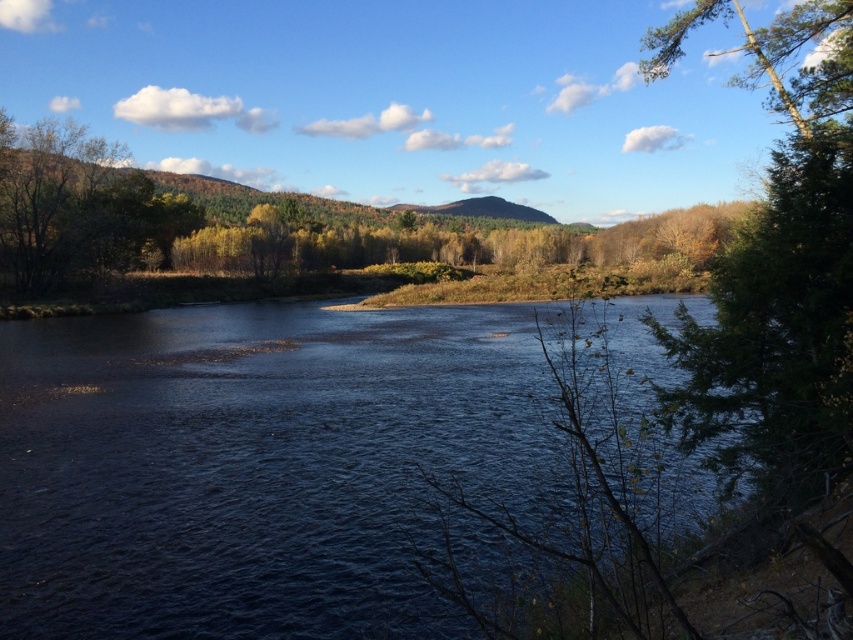
Question: From the image, what is the correct spatial relationship of dark blue water at center in relation to green textured tree at right?

Choices:
 (A) below
 (B) above

Answer: (A)

Question: In this image, where is dark blue water at center located relative to green textured tree at right?

Choices:
 (A) above
 (B) below

Answer: (B)

Question: Which point is farther to the camera?

Choices:
 (A) dark blue water at center
 (B) green textured tree at right

Answer: (B)

Question: Observing the image, what is the correct spatial positioning of dark blue water at center in reference to green textured tree at right?

Choices:
 (A) left
 (B) right

Answer: (A)